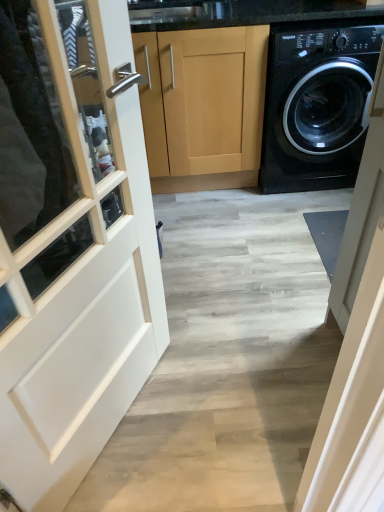
Question: Does light wood cabinet at center have a lesser height compared to black glossy washing machine at right?

Choices:
 (A) yes
 (B) no

Answer: (B)

Question: From the image's perspective, is light wood cabinet at center located above black glossy washing machine at right?

Choices:
 (A) yes
 (B) no

Answer: (B)

Question: Is light wood cabinet at center at the right side of black glossy washing machine at right?

Choices:
 (A) yes
 (B) no

Answer: (B)

Question: Does light wood cabinet at center have a larger size compared to black glossy washing machine at right?

Choices:
 (A) no
 (B) yes

Answer: (B)

Question: Are light wood cabinet at center and black glossy washing machine at right far apart?

Choices:
 (A) no
 (B) yes

Answer: (A)

Question: Could you tell me if light wood cabinet at center is facing black glossy washing machine at right?

Choices:
 (A) no
 (B) yes

Answer: (A)

Question: From a real-world perspective, does black glossy washing machine at right sit lower than light wood cabinet at center?

Choices:
 (A) no
 (B) yes

Answer: (A)

Question: Does black glossy washing machine at right have a greater height compared to light wood cabinet at center?

Choices:
 (A) yes
 (B) no

Answer: (B)

Question: Are black glossy washing machine at right and light wood cabinet at center beside each other?

Choices:
 (A) no
 (B) yes

Answer: (A)

Question: Can we say black glossy washing machine at right lies outside light wood cabinet at center?

Choices:
 (A) yes
 (B) no

Answer: (A)

Question: Would you say black glossy washing machine at right contains light wood cabinet at center?

Choices:
 (A) yes
 (B) no

Answer: (B)

Question: Considering the relative positions of black glossy washing machine at right and light wood cabinet at center in the image provided, is black glossy washing machine at right to the left of light wood cabinet at center from the viewer's perspective?

Choices:
 (A) no
 (B) yes

Answer: (A)

Question: From a real-world perspective, is black glossy washing machine at right positioned above or below light wood cabinet at center?

Choices:
 (A) above
 (B) below

Answer: (A)